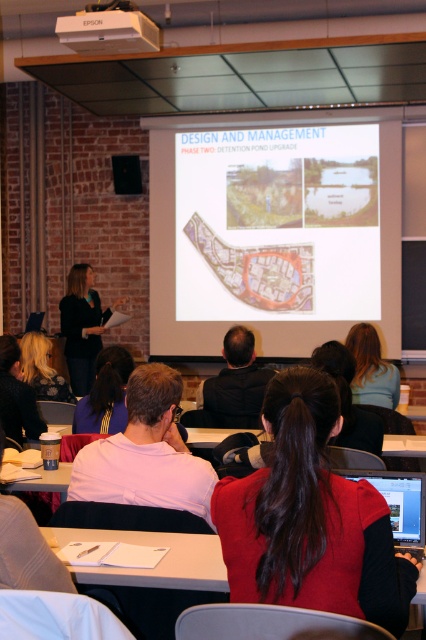
Is white matte projection screen at center smaller than blonde hair at upper center?

No, white matte projection screen at center is not smaller than blonde hair at upper center.

Is white matte projection screen at center above blonde hair at upper center?

Yes.

You are a GUI agent. You are given a task and a screenshot of the screen. Output one action in this format:
    pyautogui.click(x=<x>, y=<y>)
    Task: Click on the white matte projection screen at center
    
    Given the screenshot: What is the action you would take?
    pyautogui.click(x=273, y=234)

Is matte black laptop at center bigger than blonde hair at upper left?

Actually, matte black laptop at center might be smaller than blonde hair at upper left.

Find the location of a particular element. This screenshot has width=426, height=640. matte black laptop at center is located at coordinates (400, 506).

You are a GUI agent. You are given a task and a screenshot of the screen. Output one action in this format:
    pyautogui.click(x=<x>, y=<y>)
    Task: Click on the matte black laptop at center
    This screenshot has height=640, width=426.
    Given the screenshot: What is the action you would take?
    pyautogui.click(x=400, y=506)

Which is more to the right, black fabric at center or black fabric at left?

black fabric at center is more to the right.

Is black fabric at center above black fabric at left?

No, black fabric at center is not above black fabric at left.

Describe the element at coordinates (236, 384) in the screenshot. I see `black fabric at center` at that location.

This screenshot has height=640, width=426. What are the coordinates of `black fabric at center` in the screenshot? It's located at (236, 384).